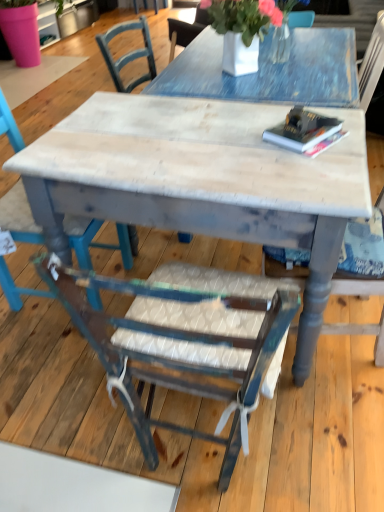
I want to click on free spot to the left of hardcover book at upper right, so click(246, 150).